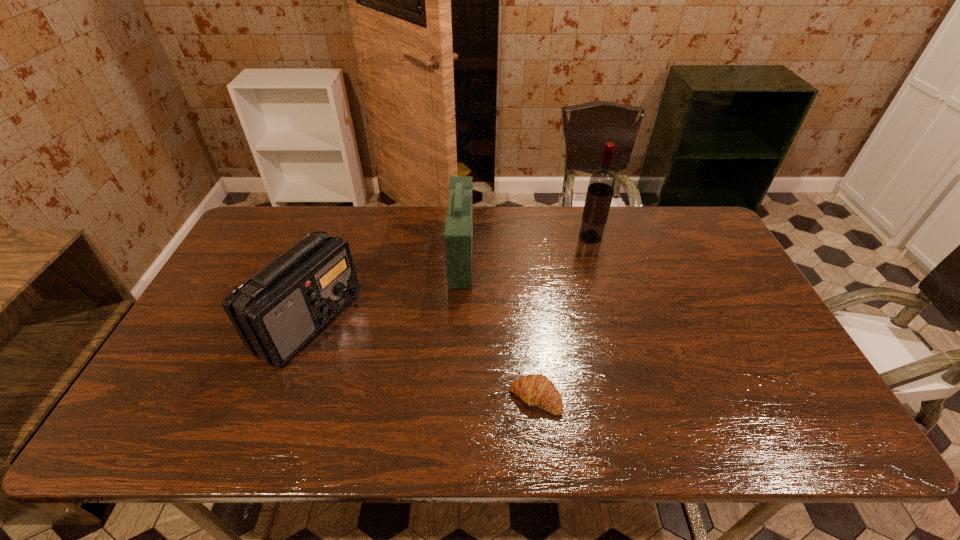
Find the location of `free point that satisfies the following two spatial constraints: 1. on the back side of the crescent roll; 2. on the front panel of the leftmost object`. free point that satisfies the following two spatial constraints: 1. on the back side of the crescent roll; 2. on the front panel of the leftmost object is located at coordinates (x=528, y=321).

Where is `free space in the image that satisfies the following two spatial constraints: 1. on the back side of the wine bottle; 2. on the right side of the shortest object`? The width and height of the screenshot is (960, 540). free space in the image that satisfies the following two spatial constraints: 1. on the back side of the wine bottle; 2. on the right side of the shortest object is located at coordinates [519, 238].

This screenshot has height=540, width=960. Identify the location of vacant position in the image that satisfies the following two spatial constraints: 1. on the front panel of the radio receiver; 2. on the right side of the nearest object. (281, 398).